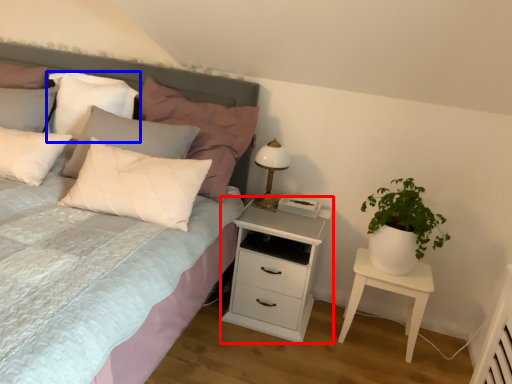
Question: Which object appears closest to the camera in this image, nightstand (highlighted by a red box) or pillow (highlighted by a blue box)?

Choices:
 (A) nightstand
 (B) pillow

Answer: (A)